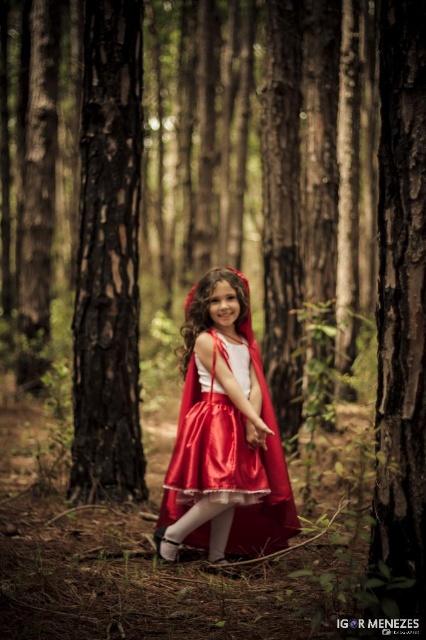
You are a hiker who wants to touch the smooth dark brown bark mentioned at point (108, 259). Based on the scene description, is this point located to the left or right side of the image?

The point (108, 259) is located at the left side of the image since the smooth dark brown bark at left is mentioned there.

You are a hiker who wants to take a photo of the satin red cape at center and the smooth dark brown bark at left. Which object should you focus on first if you want to capture both in the same frame without moving the camera?

You should focus on the satin red cape at center first because the smooth dark brown bark at left is to the left of it, meaning both are already aligned horizontally in the frame.